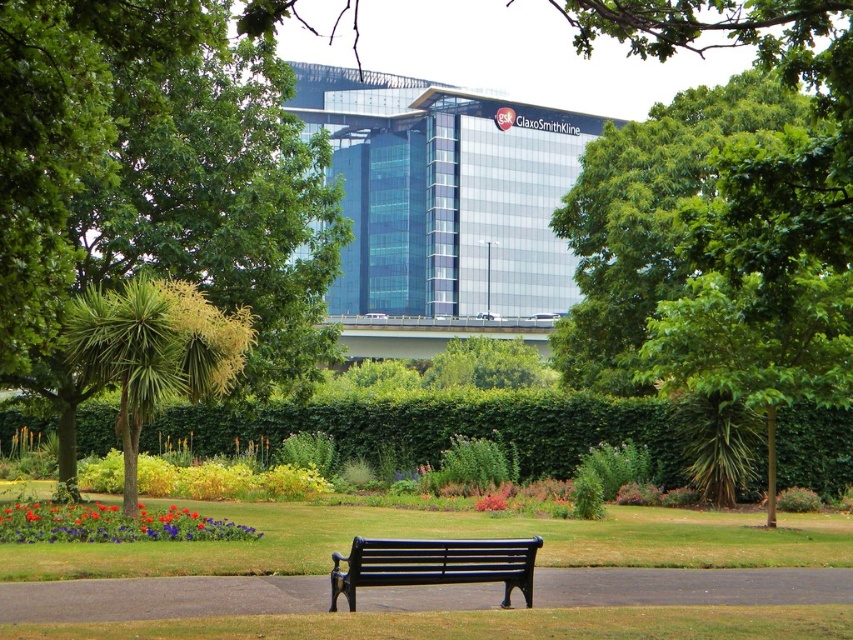
Which is more to the left, green leafy tree at left or black metal bench at center?

green leafy tree at left is more to the left.

Based on the photo, does green leafy tree at left appear over black metal bench at center?

Indeed, green leafy tree at left is positioned over black metal bench at center.

Is point (154, 296) farther from camera compared to point (363, 557)?

Yes, it is.

The width and height of the screenshot is (853, 640). In order to click on green leafy tree at left in this screenshot , I will do `click(154, 353)`.

Between green leafy tree at center and green leafy tree at left, which one appears on the right side from the viewer's perspective?

green leafy tree at left

Between green leafy tree at center and green leafy tree at left, which one has less height?

With less height is green leafy tree at left.

The height and width of the screenshot is (640, 853). What do you see at coordinates (155, 182) in the screenshot?
I see `green leafy tree at center` at bounding box center [155, 182].

At what (x,y) coordinates should I click in order to perform the action: click on green leafy tree at center. Please return your answer as a coordinate pair (x, y). The height and width of the screenshot is (640, 853). Looking at the image, I should click on (155, 182).

In the scene shown: Is green leafy tree at center above black metal bench at center?

Yes, green leafy tree at center is above black metal bench at center.

Find the location of `green leafy tree at center`. green leafy tree at center is located at coordinates (155, 182).